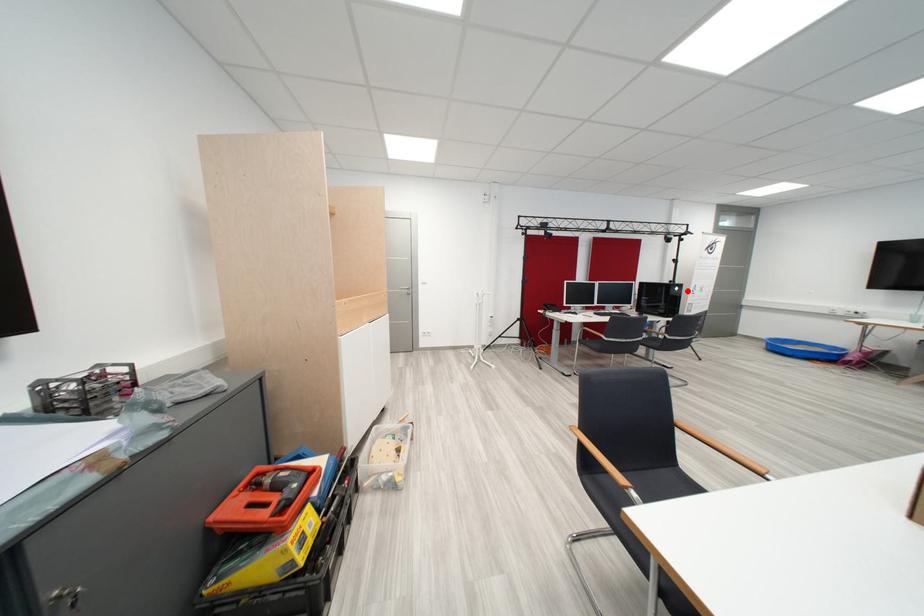
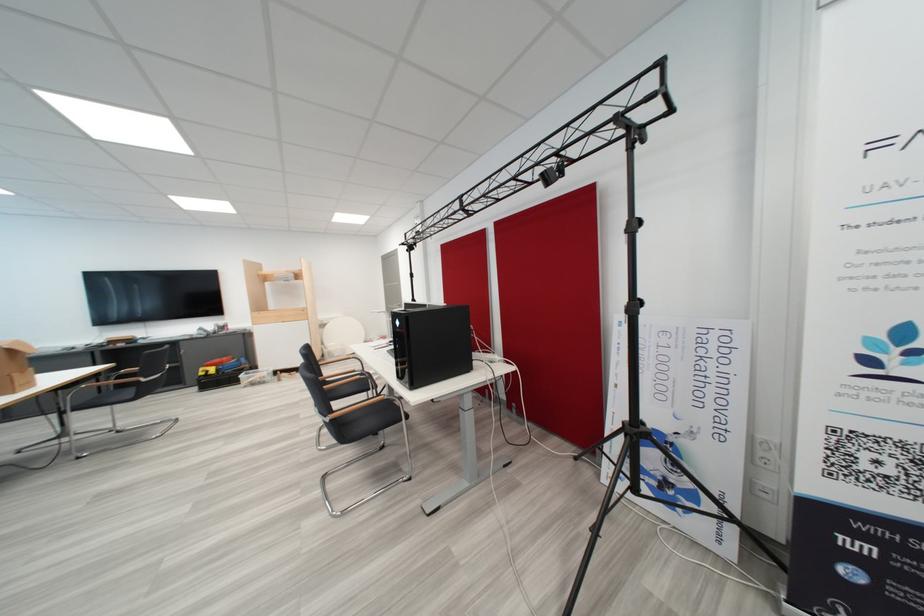
In the second image, find the point that corresponds to the highlighted location in the first image.

(407, 325)